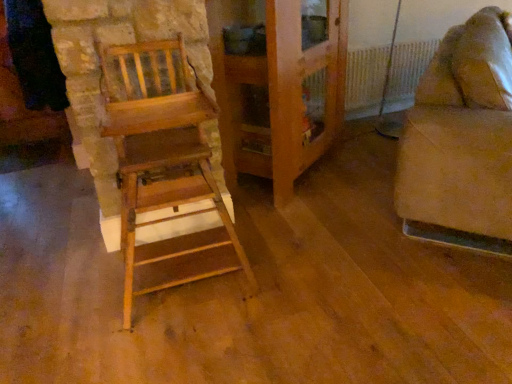
Question: Is wooden cabinet at center not near beige fabric couch at right, placed as the 2th furniture when sorted from left to right?

Choices:
 (A) no
 (B) yes

Answer: (A)

Question: From the image's perspective, is wooden cabinet at center on top of beige fabric couch at right, which is the first furniture from right to left?

Choices:
 (A) yes
 (B) no

Answer: (A)

Question: Is the position of wooden cabinet at center more distant than that of beige fabric couch at right, which is the first furniture from right to left?

Choices:
 (A) yes
 (B) no

Answer: (A)

Question: Is wooden cabinet at center to the right of beige fabric couch at right, placed as the 2th furniture when sorted from left to right, from the viewer's perspective?

Choices:
 (A) no
 (B) yes

Answer: (A)

Question: Considering the relative sizes of wooden cabinet at center and beige fabric couch at right, which is the first furniture from right to left, in the image provided, is wooden cabinet at center thinner than beige fabric couch at right, which is the first furniture from right to left,?

Choices:
 (A) yes
 (B) no

Answer: (A)

Question: Is wooden chair at left, marked as the 2th furniture in a right-to-left arrangement, in front of or behind white plastic radiator at upper right in the image?

Choices:
 (A) behind
 (B) front

Answer: (B)

Question: From a real-world perspective, relative to white plastic radiator at upper right, is wooden chair at left, placed as the 1th furniture when sorted from left to right, vertically above or below?

Choices:
 (A) below
 (B) above

Answer: (B)

Question: Is wooden chair at left, marked as the 2th furniture in a right-to-left arrangement, wider or thinner than white plastic radiator at upper right?

Choices:
 (A) thin
 (B) wide

Answer: (B)

Question: From the image's perspective, is wooden chair at left, marked as the 2th furniture in a right-to-left arrangement, located above or below white plastic radiator at upper right?

Choices:
 (A) below
 (B) above

Answer: (A)

Question: From their relative heights in the image, would you say beige fabric couch at right, placed as the 2th furniture when sorted from left to right, is taller or shorter than white plastic radiator at upper right?

Choices:
 (A) tall
 (B) short

Answer: (A)

Question: From the image's perspective, is beige fabric couch at right, which is the first furniture from right to left, positioned above or below white plastic radiator at upper right?

Choices:
 (A) above
 (B) below

Answer: (B)

Question: Considering the positions of beige fabric couch at right, placed as the 2th furniture when sorted from left to right, and white plastic radiator at upper right in the image, is beige fabric couch at right, placed as the 2th furniture when sorted from left to right, wider or thinner than white plastic radiator at upper right?

Choices:
 (A) wide
 (B) thin

Answer: (A)

Question: Which is correct: beige fabric couch at right, placed as the 2th furniture when sorted from left to right, is inside white plastic radiator at upper right, or outside of it?

Choices:
 (A) outside
 (B) inside

Answer: (A)

Question: Considering the positions of wooden cabinet at center and wooden chair at left, placed as the 1th furniture when sorted from left to right, in the image, is wooden cabinet at center bigger or smaller than wooden chair at left, placed as the 1th furniture when sorted from left to right,?

Choices:
 (A) small
 (B) big

Answer: (B)

Question: Is point (254, 152) closer or farther from the camera than point (106, 74)?

Choices:
 (A) closer
 (B) farther

Answer: (B)